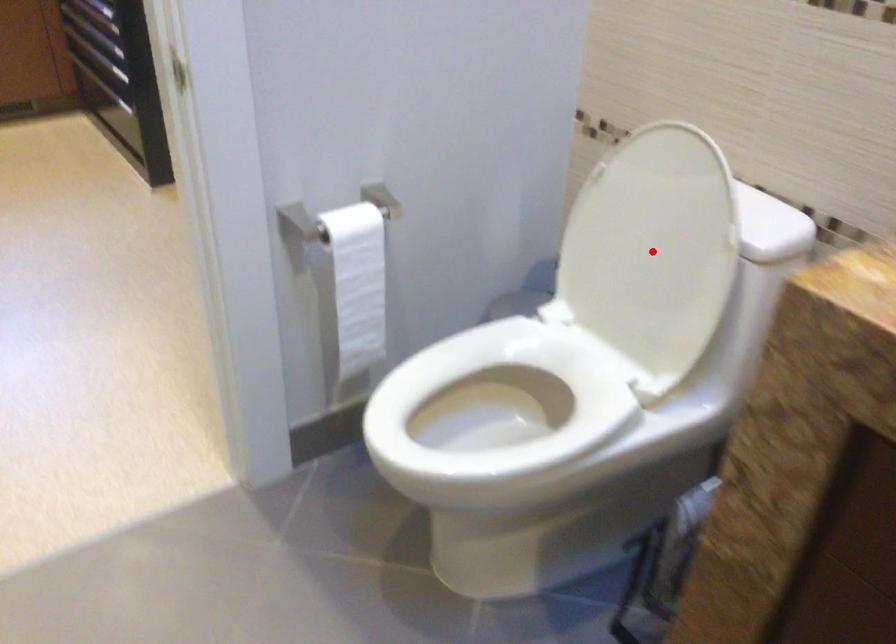
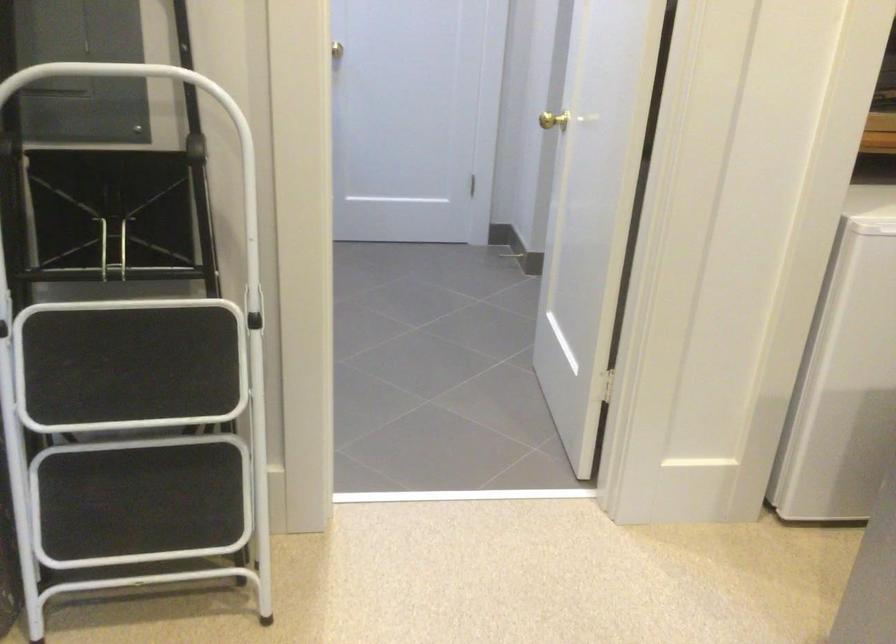
Question: I am providing you with two images of the same scene from different viewpoints. A red point is marked on the first image. At the location where the point appears in image 1, is it still visible in image 2?

Choices:
 (A) Yes
 (B) No

Answer: (B)